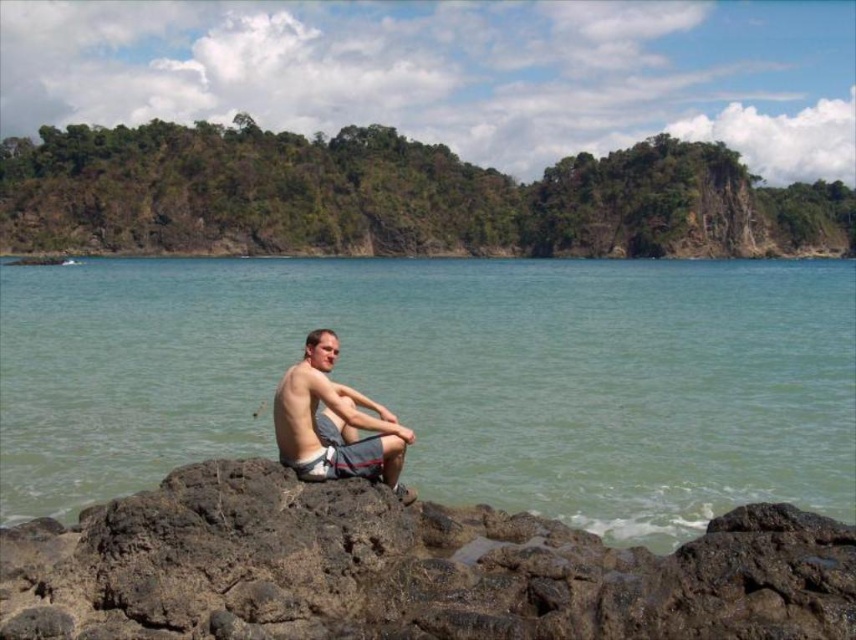
Can you confirm if clear water at center is thinner than matte gray shorts at center?

Incorrect, clear water at center's width is not less than matte gray shorts at center's.

Which is behind, point (367, 280) or point (340, 465)?

The point (367, 280) is behind.

Where is `clear water at center`? clear water at center is located at coordinates (449, 378).

Who is shorter, brown rough rock at lower center or matte gray shorts at center?

With less height is brown rough rock at lower center.

Who is more distant from viewer, [528,628] or [280,433]?

The point [280,433] is more distant.

Identify the location of brown rough rock at lower center. (405, 570).

Between clear water at center and brown rough rock at lower center, which one is positioned lower?

brown rough rock at lower center is below.

Who is more distant from viewer, (48,486) or (615,608)?

The point (48,486) is more distant.

Is point (111, 429) in front of point (254, 637)?

That is False.

Locate an element on the screen. clear water at center is located at coordinates (449, 378).